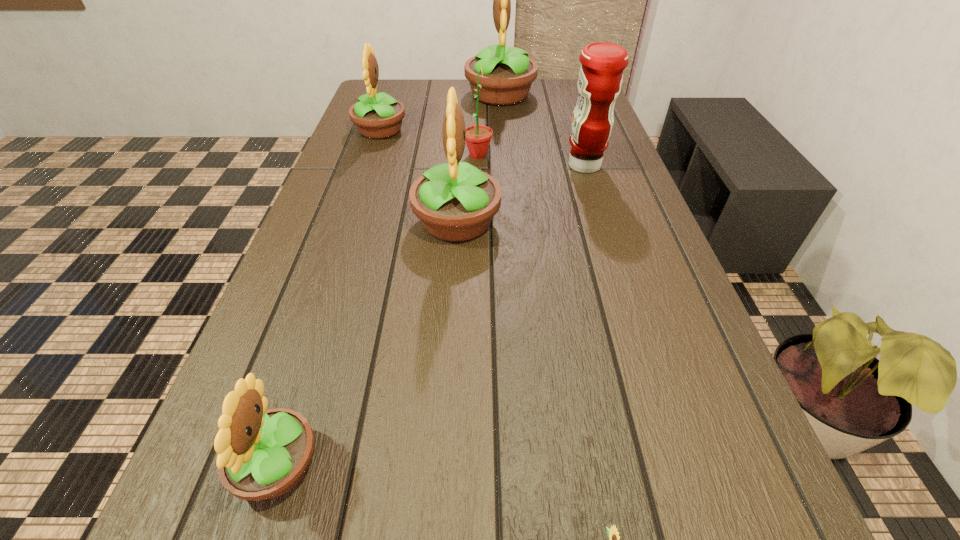
Identify the location of the second nearest sunflower. This screenshot has height=540, width=960. (262, 454).

Identify the location of the smallest yellow sunflower. The image size is (960, 540). (262, 454).

Locate an element on the screen. Image resolution: width=960 pixels, height=540 pixels. blank area located 0.210m on the face of the farthest object is located at coordinates (402, 95).

The width and height of the screenshot is (960, 540). I want to click on free space located 0.130m on the face of the farthest object, so click(x=426, y=95).

Identify the location of vacant space located on the face of the farthest object. (447, 95).

The height and width of the screenshot is (540, 960). I want to click on free space located on the face of the second tallest sunflower, so click(x=652, y=222).

This screenshot has width=960, height=540. In order to click on vacant position located 0.220m on the left of the red condiment in this screenshot , I will do `click(480, 165)`.

I want to click on free region located on the face of the second farthest object, so click(465, 130).

The image size is (960, 540). In order to click on free region located on the face of the bigger green sunflower in this screenshot , I will do point(610,155).

This screenshot has height=540, width=960. Find the location of `vacant space located 0.280m on the face of the sixth farthest object`. vacant space located 0.280m on the face of the sixth farthest object is located at coordinates (523, 466).